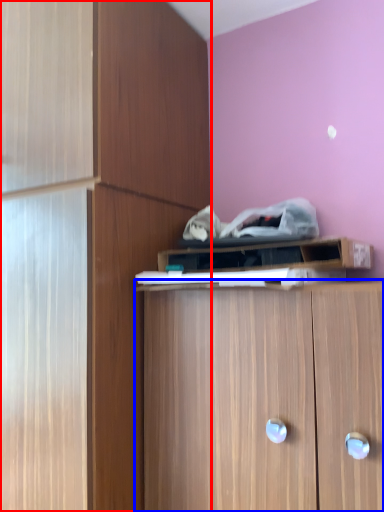
Question: Among these objects, which one is farthest to the camera, cabinetry (highlighted by a red box) or cabinetry (highlighted by a blue box)?

Choices:
 (A) cabinetry
 (B) cabinetry

Answer: (A)